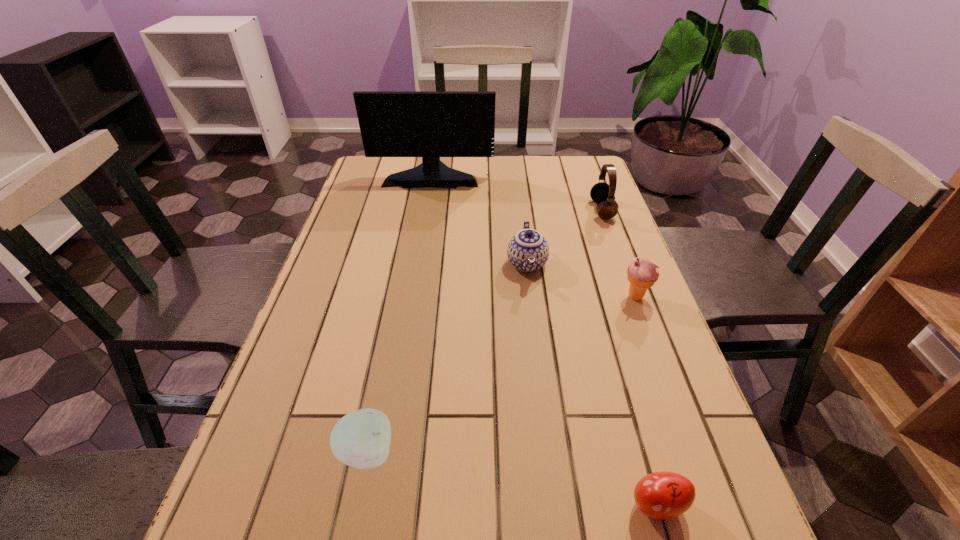
Select which object is the second closest to the headset. Please provide its 2D coordinates. Your answer should be formatted as a tuple, i.e. [(x, y)], where the tuple contains the x and y coordinates of a point satisfying the conditions above.

[(642, 274)]

In order to click on free location that satisfies the following two spatial constraints: 1. on the ear pads of the headset; 2. on the left side of the icecream in this screenshot , I will do `click(634, 297)`.

At what (x,y) coordinates should I click in order to perform the action: click on vacant space that satisfies the following two spatial constraints: 1. on the ear pads of the headset; 2. at the spout of the chinaware. Please return your answer as a coordinate pair (x, y). The width and height of the screenshot is (960, 540). Looking at the image, I should click on (622, 264).

Locate an element on the screen. free location that satisfies the following two spatial constraints: 1. on the screen side of the monitor; 2. on the right side of the icecream is located at coordinates (412, 297).

The height and width of the screenshot is (540, 960). I want to click on free space that satisfies the following two spatial constraints: 1. on the screen side of the icecream; 2. on the left side of the farthest object, so click(412, 297).